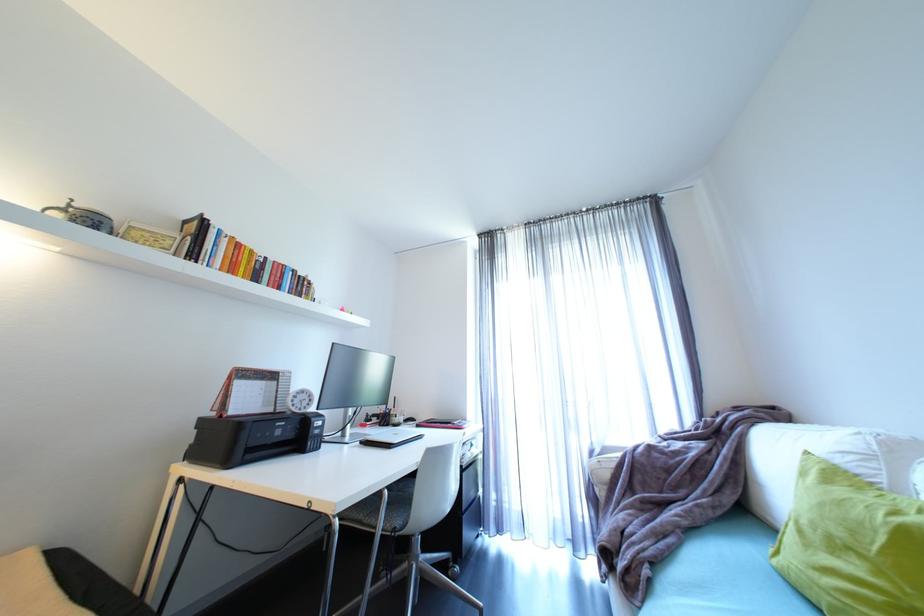
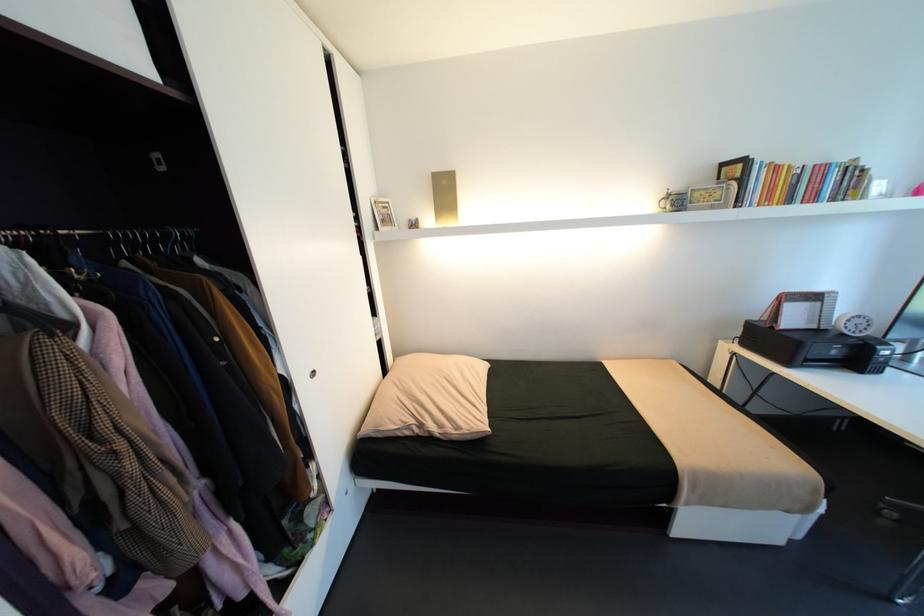
Locate, in the second image, the point that corresponds to pixel 138 233 in the first image.

(700, 196)